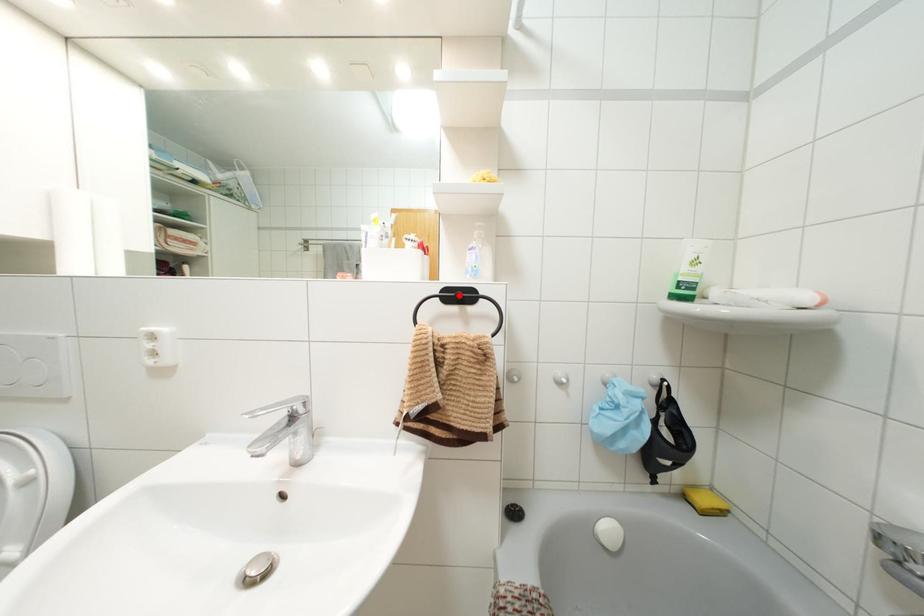
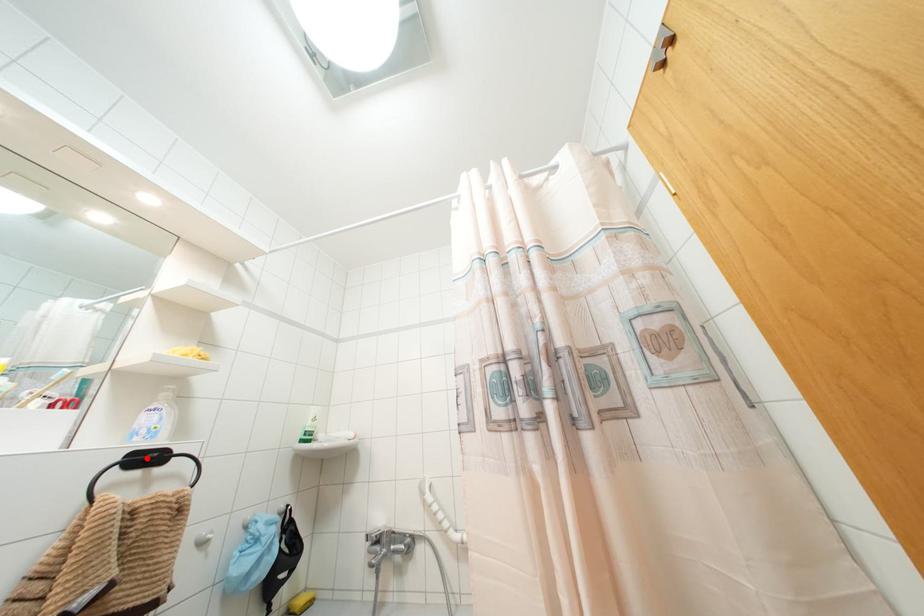
I am providing you with two images of the same scene from different viewpoints. A red point is marked on the first image and another point is marked on the second image. Do the highlighted points in image1 and image2 indicate the same real-world spot?

Yes